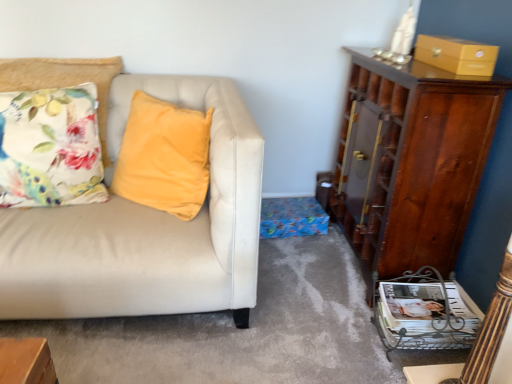
The width and height of the screenshot is (512, 384). In order to click on floral fabric cushion at left in this screenshot , I will do `click(50, 148)`.

What do you see at coordinates (456, 55) in the screenshot?
I see `matte yellow box at upper right` at bounding box center [456, 55].

At what (x,y) coordinates should I click in order to perform the action: click on shiny brown cabinet at right. Please return your answer as a coordinate pair (x, y). Looking at the image, I should click on (415, 163).

From a real-world perspective, which is physically above, shiny brown cabinet at right or floral fabric cushion at left?

floral fabric cushion at left is physically above.

Which object is further away from the camera, shiny brown cabinet at right or floral fabric cushion at left?

Positioned behind is floral fabric cushion at left.

Considering the relative sizes of shiny brown cabinet at right and floral fabric cushion at left in the image provided, is shiny brown cabinet at right smaller than floral fabric cushion at left?

Incorrect, shiny brown cabinet at right is not smaller in size than floral fabric cushion at left.

Where is `pillow positioned vertically above the shiny brown cabinet at right (from a real-world perspective)`? This screenshot has height=384, width=512. pillow positioned vertically above the shiny brown cabinet at right (from a real-world perspective) is located at coordinates (50, 148).

Would you say shiny brown cabinet at right is outside matte yellow box at upper right?

shiny brown cabinet at right lies outside matte yellow box at upper right's area.

Which of these two, shiny brown cabinet at right or matte yellow box at upper right, stands shorter?

With less height is matte yellow box at upper right.

Does point (465, 140) come closer to viewer compared to point (419, 51)?

Yes.

Is shiny brown cabinet at right to the left or to the right of matte yellow box at upper right in the image?

In the image, shiny brown cabinet at right appears on the left side of matte yellow box at upper right.

Does matte yellow box at upper right turn towards floral fabric cushion at left?

No, matte yellow box at upper right does not turn towards floral fabric cushion at left.

Which is in front, matte yellow box at upper right or floral fabric cushion at left?

matte yellow box at upper right.

Which is more to the right, matte yellow box at upper right or floral fabric cushion at left?

Positioned to the right is matte yellow box at upper right.

Between matte yellow box at upper right and floral fabric cushion at left, which one has more height?

Standing taller between the two is floral fabric cushion at left.

Measure the distance between floral fabric cushion at left and white glossy magazine at lower right.

floral fabric cushion at left and white glossy magazine at lower right are 4.61 feet apart from each other.

Is floral fabric cushion at left turned away from white glossy magazine at lower right?

floral fabric cushion at left does not have its back to white glossy magazine at lower right.

Based on the photo, can you confirm if floral fabric cushion at left is positioned to the left of white glossy magazine at lower right?

Yes.

Are floral fabric cushion at left and white glossy magazine at lower right making contact?

floral fabric cushion at left and white glossy magazine at lower right are clearly separated.

From the image's perspective, between shiny brown cabinet at right and white glossy magazine at lower right, which one is located above?

From the image's view, shiny brown cabinet at right is above.

Which of these two, shiny brown cabinet at right or white glossy magazine at lower right, stands taller?

shiny brown cabinet at right.

Is shiny brown cabinet at right at the left side of white glossy magazine at lower right?

In fact, shiny brown cabinet at right is to the right of white glossy magazine at lower right.

Which object is closer to the camera taking this photo, shiny brown cabinet at right or white glossy magazine at lower right?

Positioned in front is shiny brown cabinet at right.

Considering the sizes of objects matte yellow box at upper right and white glossy magazine at lower right in the image provided, who is taller, matte yellow box at upper right or white glossy magazine at lower right?

white glossy magazine at lower right is taller.

Considering the points (445, 48) and (404, 324), which point is in front, point (445, 48) or point (404, 324)?

The point (404, 324) is closer.

Is matte yellow box at upper right far from white glossy magazine at lower right?

No, matte yellow box at upper right is not far from white glossy magazine at lower right.

Could you tell me if matte yellow box at upper right is turned towards white glossy magazine at lower right?

No.

Is matte yellow box at upper right turned away from shiny brown cabinet at right?

No.

Who is smaller, matte yellow box at upper right or shiny brown cabinet at right?

matte yellow box at upper right.

From a real-world perspective, does matte yellow box at upper right stand above shiny brown cabinet at right?

Yes, from a real-world perspective, matte yellow box at upper right is over shiny brown cabinet at right

Locate an element on the screen. The image size is (512, 384). cabinetry in front of the floral fabric cushion at left is located at coordinates (415, 163).

Locate an element on the screen. This screenshot has height=384, width=512. cabinetry on the left side of matte yellow box at upper right is located at coordinates (415, 163).

Estimate the real-world distances between objects in this image. Which object is closer to floral fabric cushion at left, white glossy magazine at lower right or matte yellow box at upper right?

white glossy magazine at lower right.

Estimate the real-world distances between objects in this image. Which object is further from shiny brown cabinet at right, white glossy magazine at lower right or matte yellow box at upper right?

Among the two, white glossy magazine at lower right is located further to shiny brown cabinet at right.

Considering their positions, is floral fabric cushion at left positioned further to white glossy magazine at lower right than shiny brown cabinet at right?

The object further to white glossy magazine at lower right is floral fabric cushion at left.

Estimate the real-world distances between objects in this image. Which object is further from shiny brown cabinet at right, white glossy magazine at lower right or floral fabric cushion at left?

Based on the image, floral fabric cushion at left appears to be further to shiny brown cabinet at right.

When comparing their distances from matte yellow box at upper right, does floral fabric cushion at left or shiny brown cabinet at right seem further?

The object further to matte yellow box at upper right is floral fabric cushion at left.

Estimate the real-world distances between objects in this image. Which object is closer to matte yellow box at upper right, shiny brown cabinet at right or floral fabric cushion at left?

shiny brown cabinet at right is positioned closer to the anchor matte yellow box at upper right.

Which object lies further to the anchor point matte yellow box at upper right, shiny brown cabinet at right or white glossy magazine at lower right?

Among the two, white glossy magazine at lower right is located further to matte yellow box at upper right.

Looking at the image, which one is located closer to shiny brown cabinet at right, floral fabric cushion at left or white glossy magazine at lower right?

Based on the image, white glossy magazine at lower right appears to be nearer to shiny brown cabinet at right.

The image size is (512, 384). I want to click on cabinetry between matte yellow box at upper right and white glossy magazine at lower right in the vertical direction, so click(x=415, y=163).

This screenshot has width=512, height=384. What are the coordinates of `cabinetry between floral fabric cushion at left and matte yellow box at upper right from left to right` in the screenshot? It's located at [x=415, y=163].

Identify the location of magazine between floral fabric cushion at left and shiny brown cabinet at right. The width and height of the screenshot is (512, 384). (424, 316).

Where is `magazine between floral fabric cushion at left and matte yellow box at upper right from left to right`? magazine between floral fabric cushion at left and matte yellow box at upper right from left to right is located at coordinates click(424, 316).